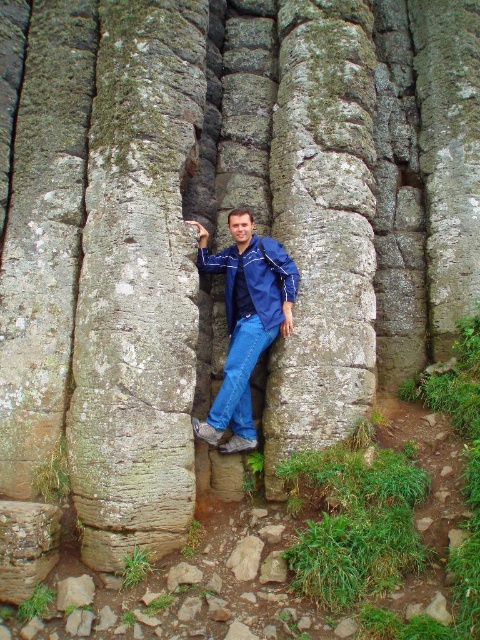
Is point (226, 408) positioned before point (232, 253)?

Yes, it is.

Measure the distance between blue denim jeans at center and blue denim jacket at center.

A distance of 7.17 inches exists between blue denim jeans at center and blue denim jacket at center.

What are the coordinates of `blue denim jeans at center` in the screenshot? It's located at (245, 321).